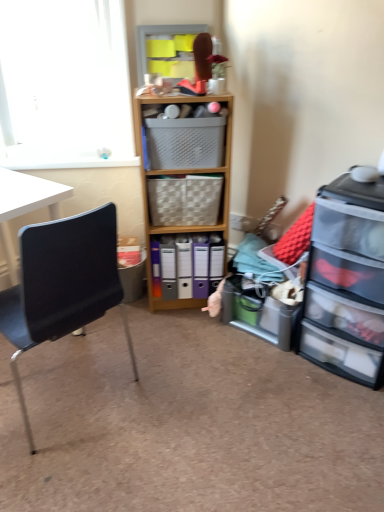
Question: Would you consider clear plastic drawers at right to be distant from translucent plastic storage at lower right, positioned as the 1th shelf in bottom-to-top order?

Choices:
 (A) no
 (B) yes

Answer: (A)

Question: From a real-world perspective, is clear plastic drawers at right located beneath translucent plastic storage at lower right, positioned as the 1th shelf in bottom-to-top order?

Choices:
 (A) no
 (B) yes

Answer: (A)

Question: Is clear plastic drawers at right wider than translucent plastic storage at lower right, which is the second shelf from top to bottom?

Choices:
 (A) yes
 (B) no

Answer: (A)

Question: Is the depth of clear plastic drawers at right greater than that of translucent plastic storage at lower right, placed as the 1th shelf when sorted from right to left?

Choices:
 (A) yes
 (B) no

Answer: (B)

Question: Is clear plastic drawers at right facing towards translucent plastic storage at lower right, positioned as the 1th shelf in bottom-to-top order?

Choices:
 (A) no
 (B) yes

Answer: (A)

Question: In terms of size, does black matte chair at left appear bigger or smaller than matte plastic shelf at upper center, arranged as the second shelf when viewed from the right?

Choices:
 (A) small
 (B) big

Answer: (B)

Question: In terms of height, does black matte chair at left look taller or shorter compared to matte plastic shelf at upper center, the 1th shelf viewed from the left?

Choices:
 (A) short
 (B) tall

Answer: (B)

Question: From a real-world perspective, is black matte chair at left above or below matte plastic shelf at upper center, arranged as the second shelf when viewed from the right?

Choices:
 (A) above
 (B) below

Answer: (B)

Question: Considering the positions of black matte chair at left and matte plastic shelf at upper center, arranged as the second shelf when viewed from the right, in the image, is black matte chair at left wider or thinner than matte plastic shelf at upper center, arranged as the second shelf when viewed from the right,?

Choices:
 (A) thin
 (B) wide

Answer: (B)

Question: In terms of size, does plastic basket at center, the second picnic basket positioned from the bottom, appear bigger or smaller than wooden cabinet at center?

Choices:
 (A) small
 (B) big

Answer: (A)

Question: Based on their positions, is plastic basket at center, the 1th picnic basket from the top, located to the left or right of wooden cabinet at center?

Choices:
 (A) right
 (B) left

Answer: (B)

Question: Considering the positions of plastic basket at center, the 1th picnic basket from the top, and wooden cabinet at center in the image, is plastic basket at center, the 1th picnic basket from the top, taller or shorter than wooden cabinet at center?

Choices:
 (A) tall
 (B) short

Answer: (B)

Question: Is point (215, 142) positioned closer to the camera than point (203, 210)?

Choices:
 (A) closer
 (B) farther

Answer: (A)

Question: In terms of width, does translucent plastic storage at lower right, positioned as the 1th shelf in bottom-to-top order, look wider or thinner when compared to woven beige picnic basket at center, arranged as the first picnic basket when ordered from the bottom?

Choices:
 (A) wide
 (B) thin

Answer: (A)

Question: From the image's perspective, is translucent plastic storage at lower right, the 2th shelf positioned from the left, positioned above or below woven beige picnic basket at center, which ranks as the 2th picnic basket in top-to-bottom order?

Choices:
 (A) below
 (B) above

Answer: (A)